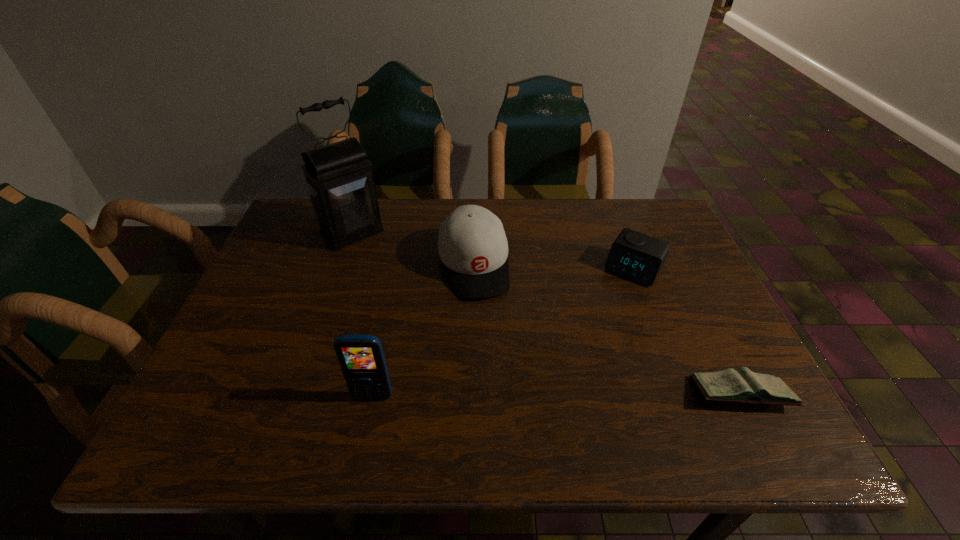
Where is `the second tallest object`? This screenshot has height=540, width=960. the second tallest object is located at coordinates (361, 357).

Locate an element on the screen. Image resolution: width=960 pixels, height=540 pixels. cellular telephone is located at coordinates (361, 357).

The image size is (960, 540). What are the coordinates of `the shortest object` in the screenshot? It's located at (743, 386).

Identify the location of the second shortest object. The width and height of the screenshot is (960, 540). (633, 255).

You are a GUI agent. You are given a task and a screenshot of the screen. Output one action in this format:
    pyautogui.click(x=<x>, y=<y>)
    Task: Click on the third object from left to right
    The height and width of the screenshot is (540, 960).
    Given the screenshot: What is the action you would take?
    pyautogui.click(x=472, y=244)

Locate an element on the screen. The image size is (960, 540). the third tallest object is located at coordinates (472, 244).

Where is `lantern`? The height and width of the screenshot is (540, 960). lantern is located at coordinates (340, 183).

Where is `the tallest object`? The image size is (960, 540). the tallest object is located at coordinates point(340,183).

Locate an element on the screen. vacant space situated 0.280m on the left of the shortest object is located at coordinates (555, 394).

In order to click on blank area located 0.100m on the front-facing side of the alarm clock in this screenshot , I will do `click(607, 309)`.